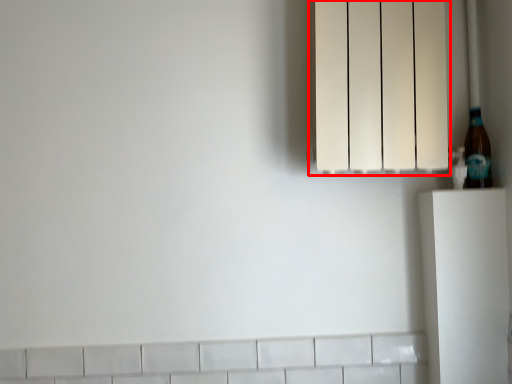
Question: From the image, what is the correct spatial relationship of lamp (annotated by the red box) in relation to bottle?

Choices:
 (A) left
 (B) right

Answer: (A)